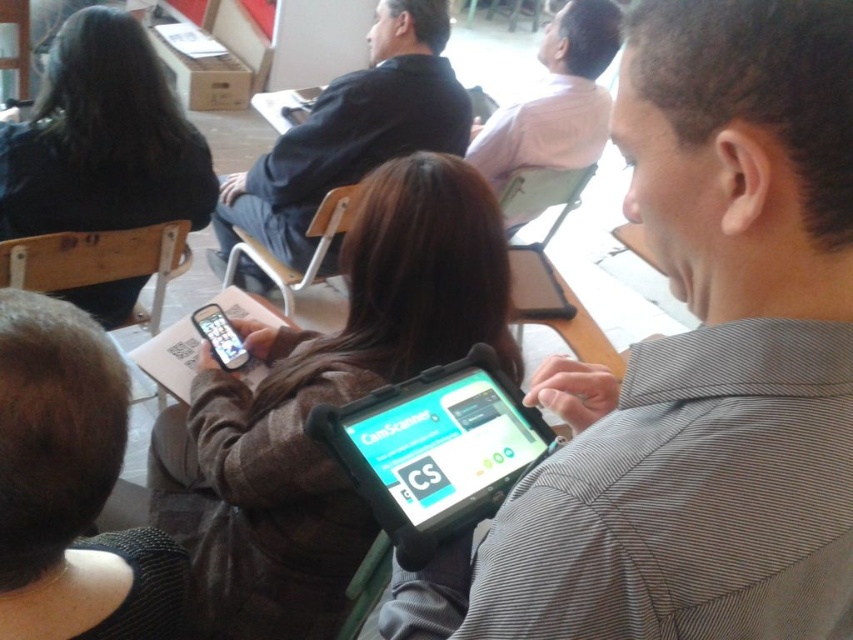
Who is more forward, (558, 561) or (321, 516)?

Positioned in front is point (558, 561).

Does gray striped shirt at center appear over matte black tablet at center?

Correct, gray striped shirt at center is located above matte black tablet at center.

Locate an element on the screen. The width and height of the screenshot is (853, 640). gray striped shirt at center is located at coordinates (697, 365).

Looking at this image, is black fabric phone at upper left to the right of black rubberized tablet at center from the viewer's perspective?

In fact, black fabric phone at upper left is to the left of black rubberized tablet at center.

Locate an element on the screen. Image resolution: width=853 pixels, height=640 pixels. black fabric phone at upper left is located at coordinates (102, 140).

I want to click on black fabric phone at upper left, so click(x=102, y=140).

Which of these two, gray striped shirt at center or pink fabric shirt at upper center, stands taller?

Standing taller between the two is pink fabric shirt at upper center.

Between gray striped shirt at center and pink fabric shirt at upper center, which one appears on the left side from the viewer's perspective?

gray striped shirt at center is more to the left.

This screenshot has width=853, height=640. Identify the location of gray striped shirt at center. (697, 365).